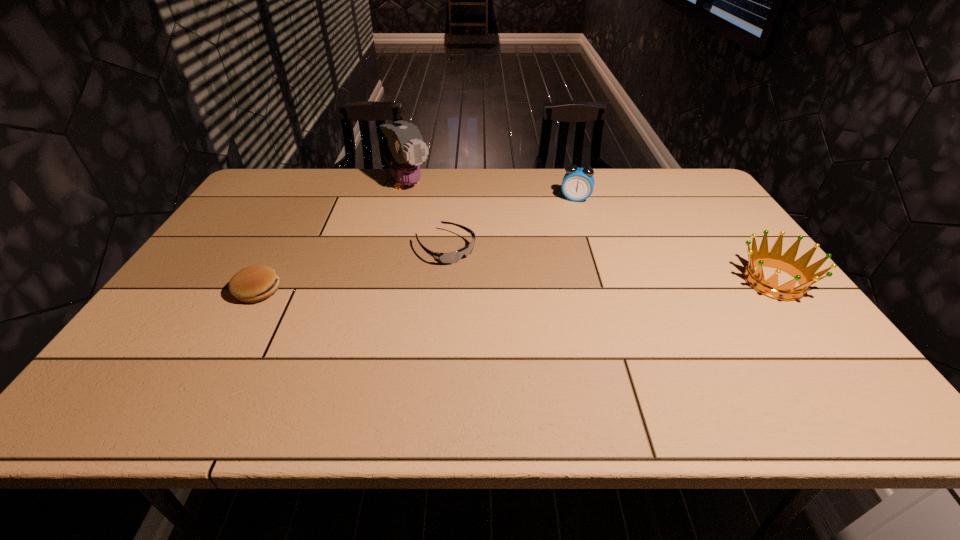
Where is `unoccupied area between the crown and the sunglasses`? This screenshot has width=960, height=540. unoccupied area between the crown and the sunglasses is located at coordinates (610, 265).

Locate an element on the screen. Image resolution: width=960 pixels, height=540 pixels. free space between the leftmost object and the alarm clock is located at coordinates (417, 245).

Locate an element on the screen. Image resolution: width=960 pixels, height=540 pixels. free space between the leftmost object and the second tallest object is located at coordinates (417, 245).

Locate an element on the screen. This screenshot has height=540, width=960. vacant point located between the alarm clock and the third shortest object is located at coordinates (675, 240).

This screenshot has width=960, height=540. I want to click on vacant area that lies between the rightmost object and the shortest object, so click(610, 265).

This screenshot has width=960, height=540. Find the location of `free spot between the second shortest object and the shortest object`. free spot between the second shortest object and the shortest object is located at coordinates point(351,269).

The height and width of the screenshot is (540, 960). In order to click on vacant region between the tallest object and the leftmost object in this screenshot , I will do `click(332, 238)`.

Identify the location of free space between the sunglasses and the bird. (426, 216).

Point out which object is positioned as the nearest to the second object from right to left. Please provide its 2D coordinates. Your answer should be formatted as a tuple, i.e. [(x, y)], where the tuple contains the x and y coordinates of a point satisfying the conditions above.

[(452, 257)]

I want to click on object that is the third closest to the third tallest object, so click(x=406, y=150).